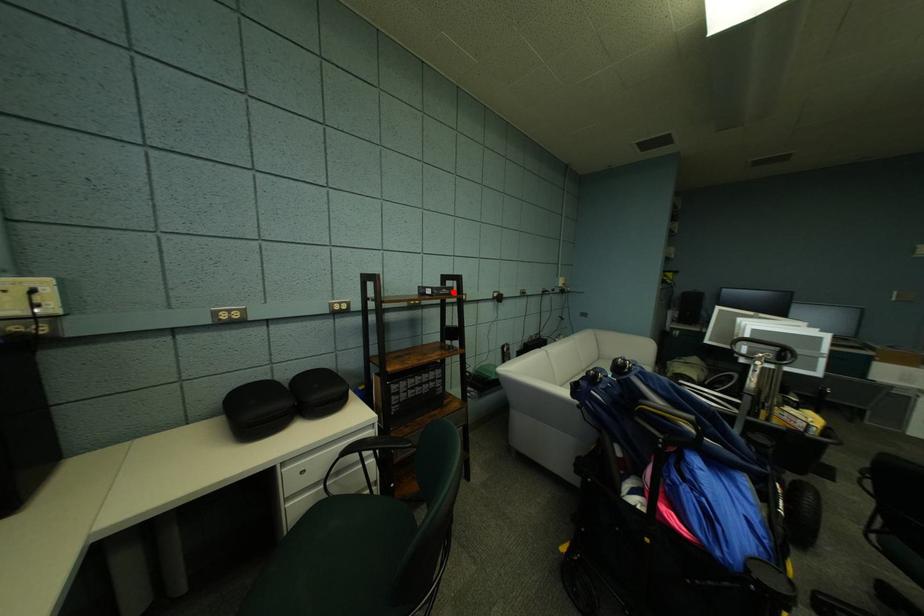
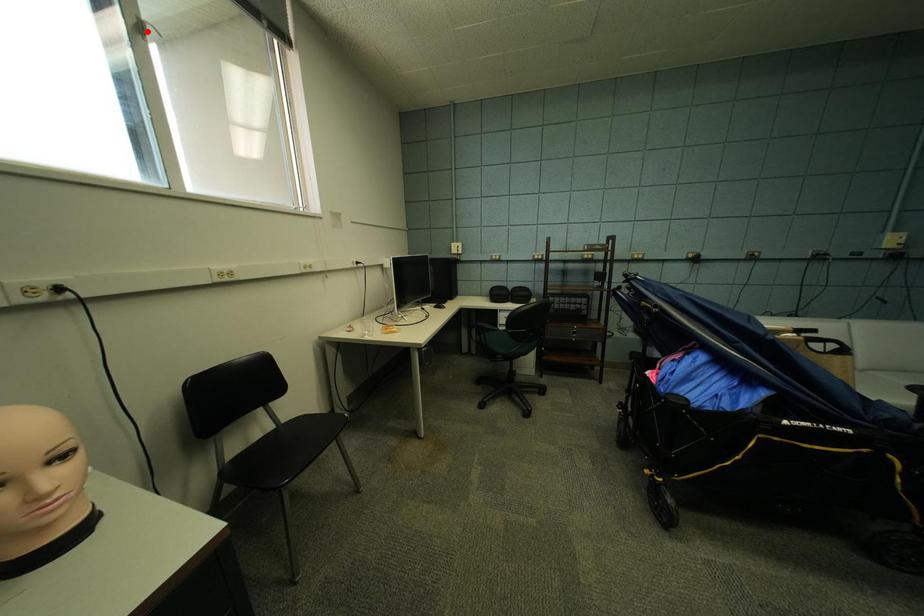
I am providing you with two images of the same scene from different viewpoints. A red point is marked on the first image and another point is marked on the second image. Is the marked point in image1 the same physical position as the marked point in image2?

No